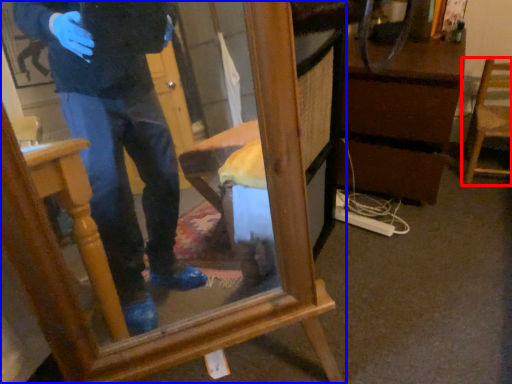
Question: Which point is closer to the camera, chair (highlighted by a red box) or furniture (highlighted by a blue box)?

Choices:
 (A) chair
 (B) furniture

Answer: (B)